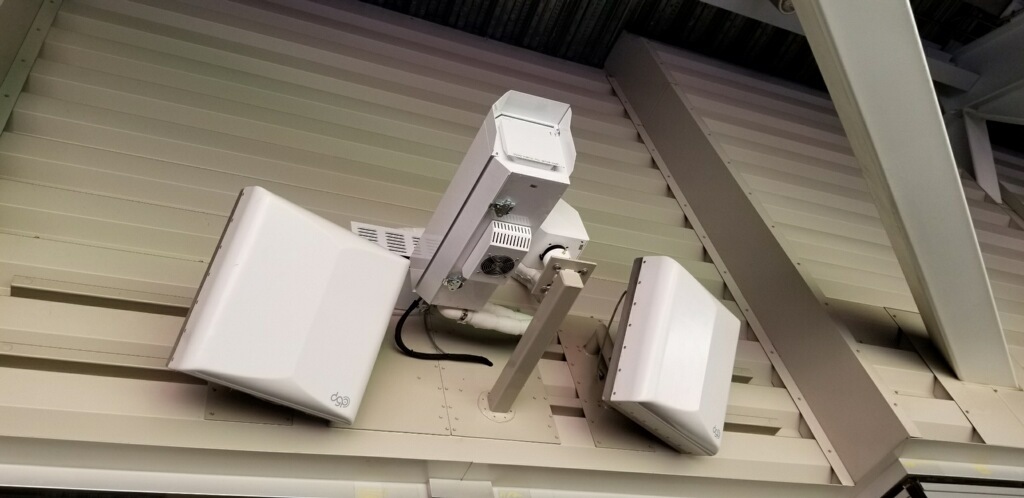
Find the location of a particular element. grate is located at coordinates (396, 238).